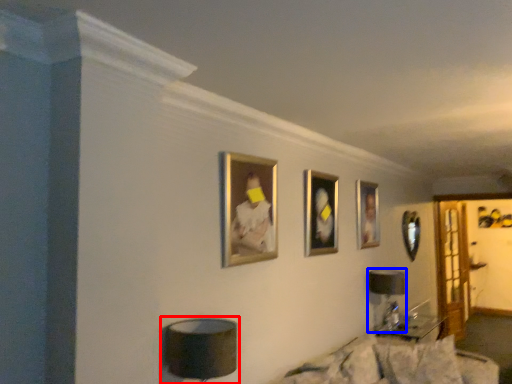
Question: Which object appears closest to the camera in this image, table lamp (highlighted by a red box) or table lamp (highlighted by a blue box)?

Choices:
 (A) table lamp
 (B) table lamp

Answer: (A)